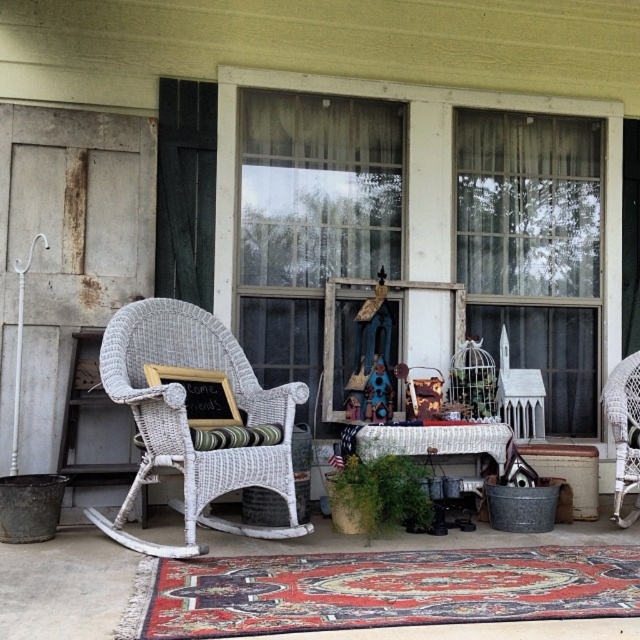
You are planning to place a large potted plant between the white wicker rocking chair at left and the white wicker chair at right. Which chair should the plant be closer to if you want to ensure it doesn

The white wicker rocking chair at left might be wider than the white wicker chair at right, so placing the plant closer to the wider chair could provide more stability and balance in the arrangement.

You are standing on the porch and want to move from the blue fabric doll at center to the white wicker chair at right. Which direction should you move to reach the chair?

The white wicker chair at right is to the right of the blue fabric doll at center, so you should move to the right to reach the chair.

You are standing on the porch and want to move from the white wicker chair at right to the small table covered with a white cloth. Which direction should you move to reach the table?

The white wicker chair at right is located at point (625, 433), so you should move to the left to reach the small table covered with a white cloth.